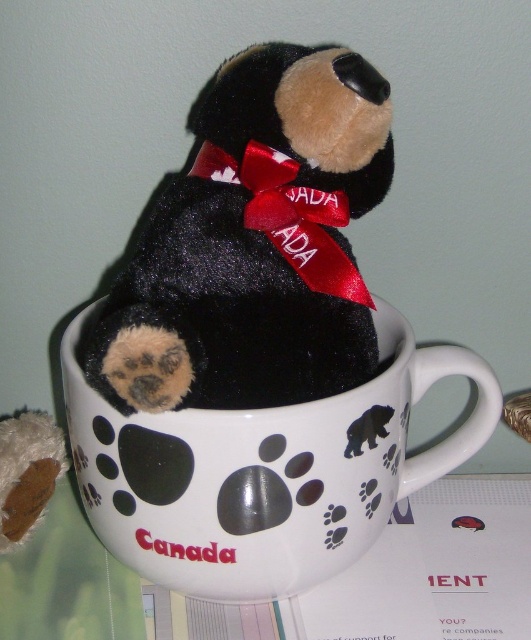
Between black plush bear at center and white glossy mug at center, which one appears on the left side from the viewer's perspective?

From the viewer's perspective, black plush bear at center appears more on the left side.

Does black plush bear at center lie behind white glossy mug at center?

No, black plush bear at center is closer to the viewer.

Does point (227, 90) come in front of point (318, 580)?

Yes.

Identify the location of black plush bear at center. (254, 244).